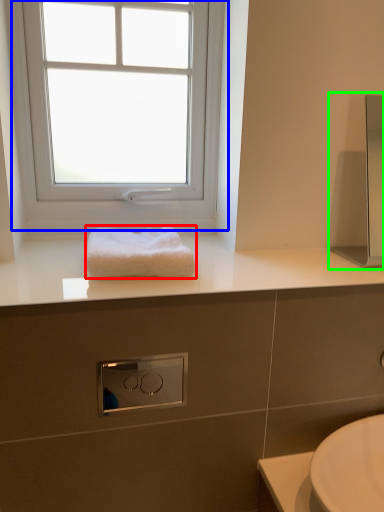
Question: Considering the real-world distances, which object is farthest from towel (highlighted by a red box)? window (highlighted by a blue box) or medicine cabinet (highlighted by a green box)?

Choices:
 (A) window
 (B) medicine cabinet

Answer: (B)